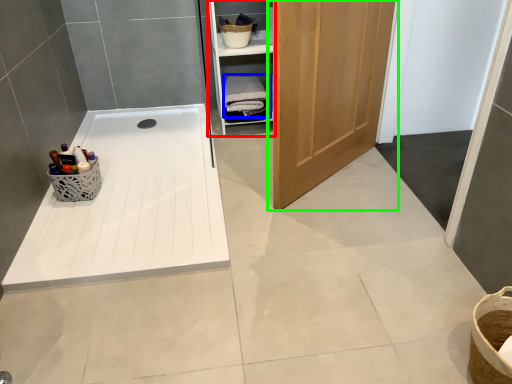
Question: Which object is positioned closest to cabinetry (highlighted by a red box)? Select from bath towel (highlighted by a blue box) and door (highlighted by a green box).

Choices:
 (A) bath towel
 (B) door

Answer: (A)